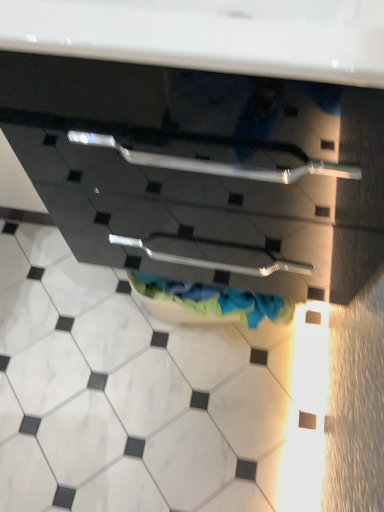
Where is `vacant region above marble tile at center (from a real-world perspective)`? This screenshot has width=384, height=512. vacant region above marble tile at center (from a real-world perspective) is located at coordinates (134, 381).